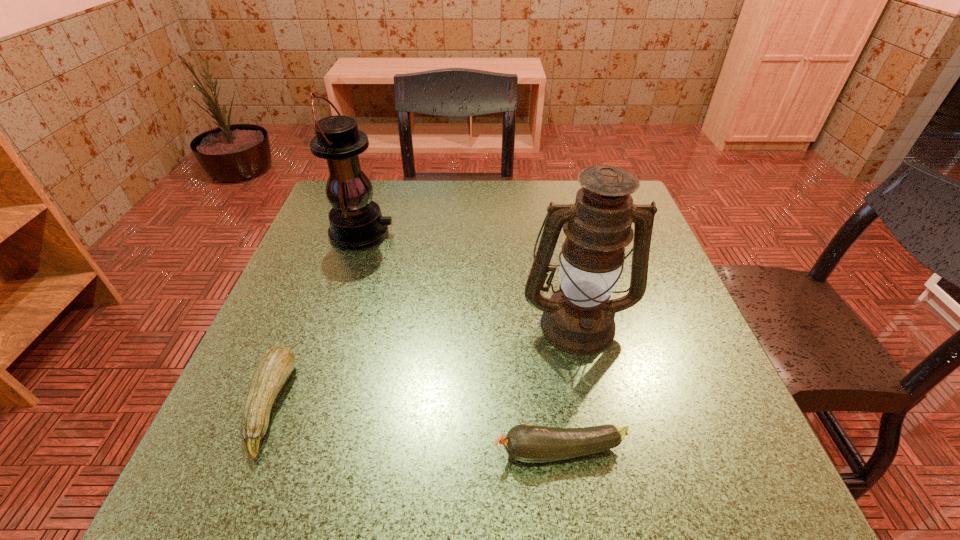
Locate which object is the closest to the oil lamp. Please provide its 2D coordinates. Your answer should be formatted as a tuple, i.e. [(x, y)], where the tuple contains the x and y coordinates of a point satisfying the conditions above.

[(528, 443)]

Locate which object ranks in proximity to the oil lamp. Please provide its 2D coordinates. Your answer should be formatted as a tuple, i.e. [(x, y)], where the tuple contains the x and y coordinates of a point satisfying the conditions above.

[(528, 443)]

This screenshot has height=540, width=960. Identify the location of vacant space that satisfies the following two spatial constraints: 1. on the front side of the third nearest object; 2. at the stem end of the left zucchini. (595, 406).

Where is `vacant space that satisfies the following two spatial constraints: 1. on the front side of the second farthest object; 2. at the blossom end of the right zucchini`? The image size is (960, 540). vacant space that satisfies the following two spatial constraints: 1. on the front side of the second farthest object; 2. at the blossom end of the right zucchini is located at coordinates coord(605,451).

The image size is (960, 540). I want to click on free location that satisfies the following two spatial constraints: 1. above the oil lamp, indicating its light source; 2. on the right side of the farthest object, so click(331, 323).

Find the location of `vacant point that satisfies the following two spatial constraints: 1. above the farthest object, indicating its light source; 2. on the right side of the oil lamp`. vacant point that satisfies the following two spatial constraints: 1. above the farthest object, indicating its light source; 2. on the right side of the oil lamp is located at coordinates (331, 323).